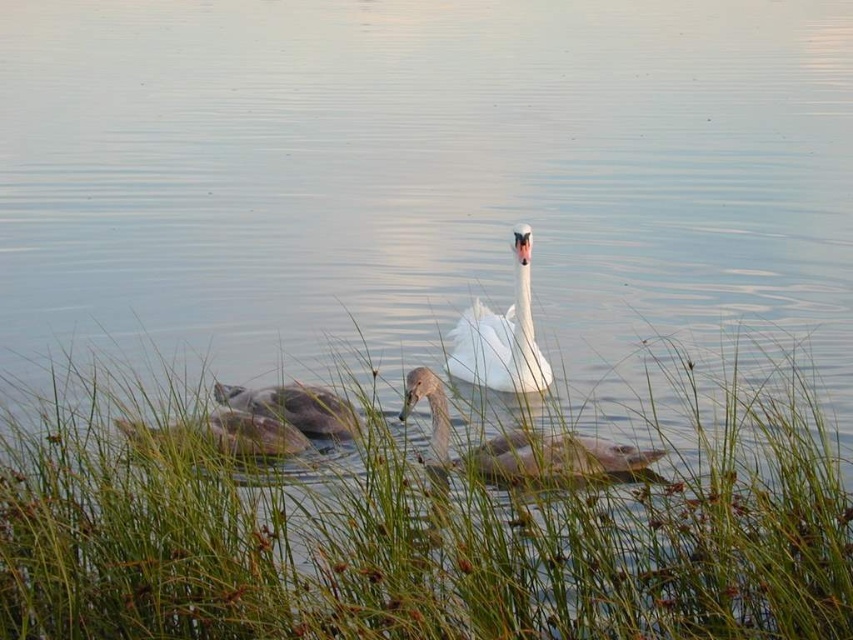
You are a birdwatcher observing the scene. You notice the white glossy swan at center and the gray matte duck at lower center. Which of the two has a smaller width?

The white glossy swan at center has a lesser width compared to the gray matte duck at lower center.